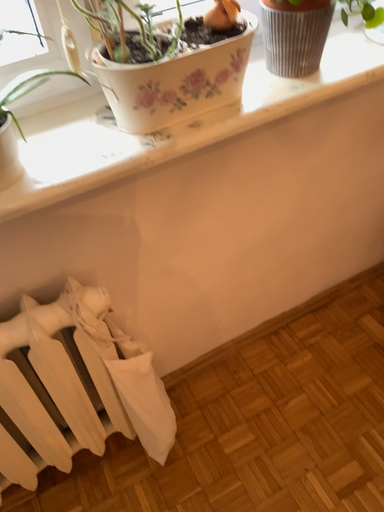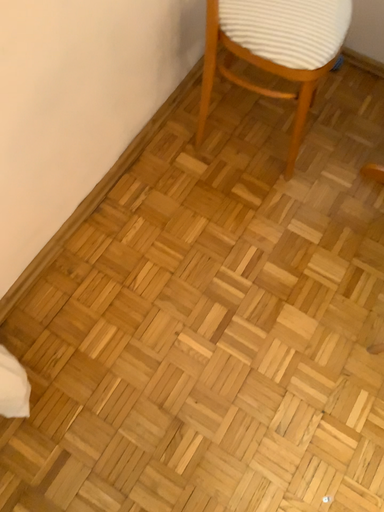
Question: Which way did the camera rotate in the video?

Choices:
 (A) rotated left
 (B) rotated right

Answer: (B)